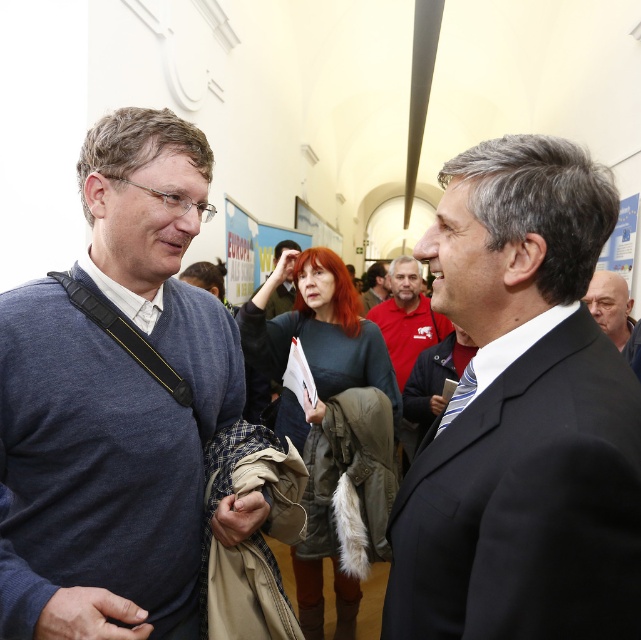
Which of these two, bald head at right or red shirt at center, stands taller?

Standing taller between the two is red shirt at center.

Can you confirm if bald head at right is bigger than red shirt at center?

Actually, bald head at right might be smaller than red shirt at center.

Which is in front, point (622, 326) or point (369, 273)?

Positioned in front is point (622, 326).

Locate an element on the screen. bald head at right is located at coordinates (610, 305).

Does black suit at center appear on the right side of bald head at right?

No, black suit at center is not to the right of bald head at right.

Between point (578, 458) and point (610, 291), which one is positioned in front?

Point (578, 458)

Is point (519, 428) positioned behind point (617, 298)?

No, it is not.

Where is `black suit at center`? black suit at center is located at coordinates (522, 417).

From the picture: Who is positioned more to the left, black suit at center or dark blue sweater at center?

From the viewer's perspective, dark blue sweater at center appears more on the left side.

Between black suit at center and dark blue sweater at center, which one appears on the right side from the viewer's perspective?

From the viewer's perspective, black suit at center appears more on the right side.

Which is behind, point (394, 600) or point (13, 401)?

Positioned behind is point (13, 401).

This screenshot has width=641, height=640. Identify the location of black suit at center. (522, 417).